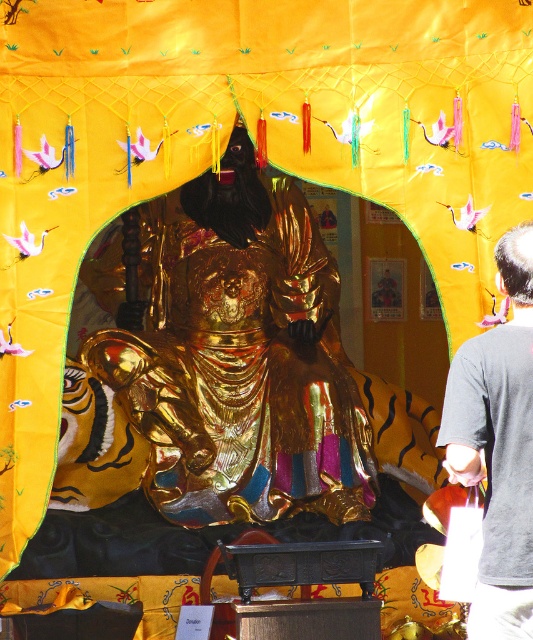
Question: Among these objects, which one is farthest from the camera?

Choices:
 (A) dark gray shirt at right
 (B) gold shiny statue at center

Answer: (B)

Question: Which point is closer to the camera?

Choices:
 (A) (514, 451)
 (B) (260, 211)

Answer: (A)

Question: Considering the relative positions of gold shiny statue at center and dark gray shirt at right in the image provided, where is gold shiny statue at center located with respect to dark gray shirt at right?

Choices:
 (A) right
 (B) left

Answer: (B)

Question: Does gold shiny statue at center lie behind dark gray shirt at right?

Choices:
 (A) no
 (B) yes

Answer: (B)

Question: Is gold shiny statue at center thinner than dark gray shirt at right?

Choices:
 (A) yes
 (B) no

Answer: (B)